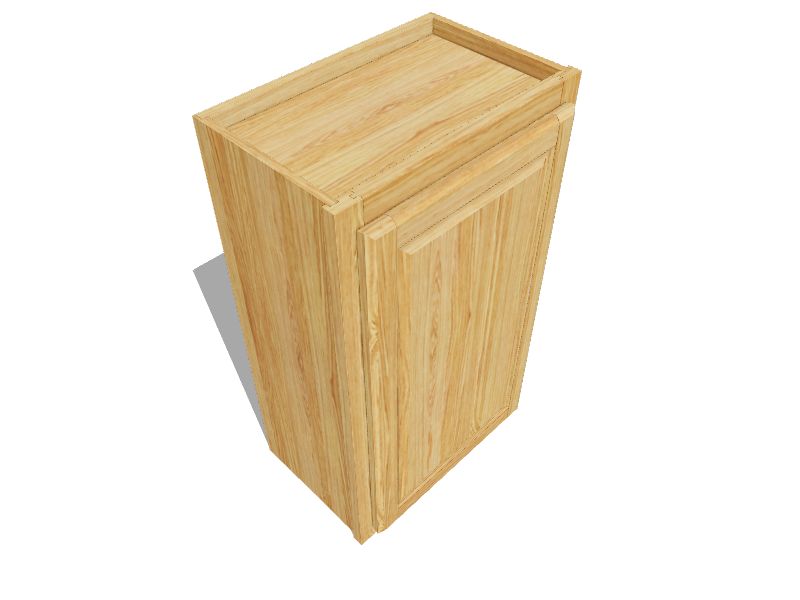
The image size is (800, 600). I want to click on dark portion of the wood grain, so click(x=214, y=158), click(x=334, y=133), click(x=417, y=140), click(x=282, y=200), click(x=318, y=230), click(x=465, y=240), click(x=506, y=214), click(x=397, y=393).